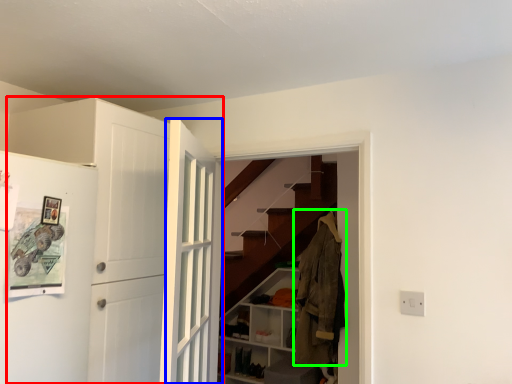
Question: Estimate the real-world distances between objects in this image. Which object is closer to door (highlighted by a red box), door (highlighted by a blue box) or clothing (highlighted by a green box)?

Choices:
 (A) door
 (B) clothing

Answer: (A)